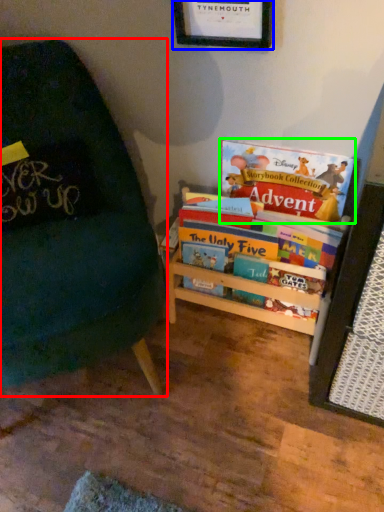
Question: Which is farther away from chair (highlighted by a red box)? picture frame (highlighted by a blue box) or book (highlighted by a green box)?

Choices:
 (A) picture frame
 (B) book

Answer: (A)